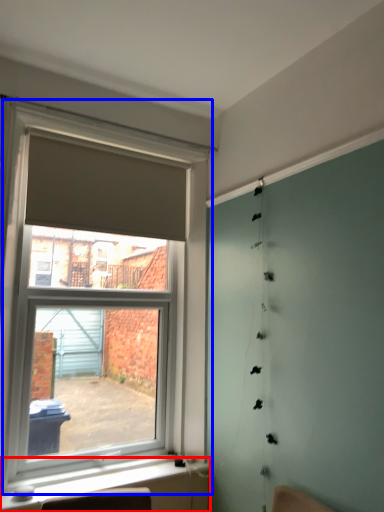
Question: Which object appears closest to the camera in this image, window sill (highlighted by a red box) or window (highlighted by a blue box)?

Choices:
 (A) window sill
 (B) window

Answer: (B)